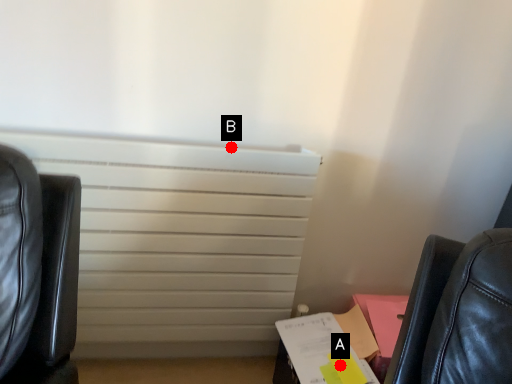
Question: Two points are circled on the image, labeled by A and B beside each circle. Which of the following is the closest to the observer?

Choices:
 (A) A is closer
 (B) B is closer

Answer: (A)